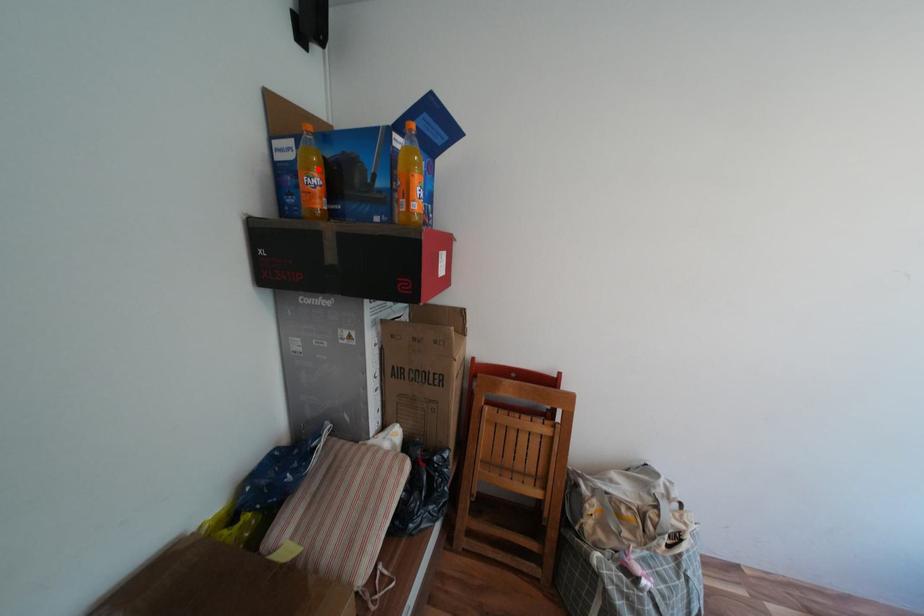
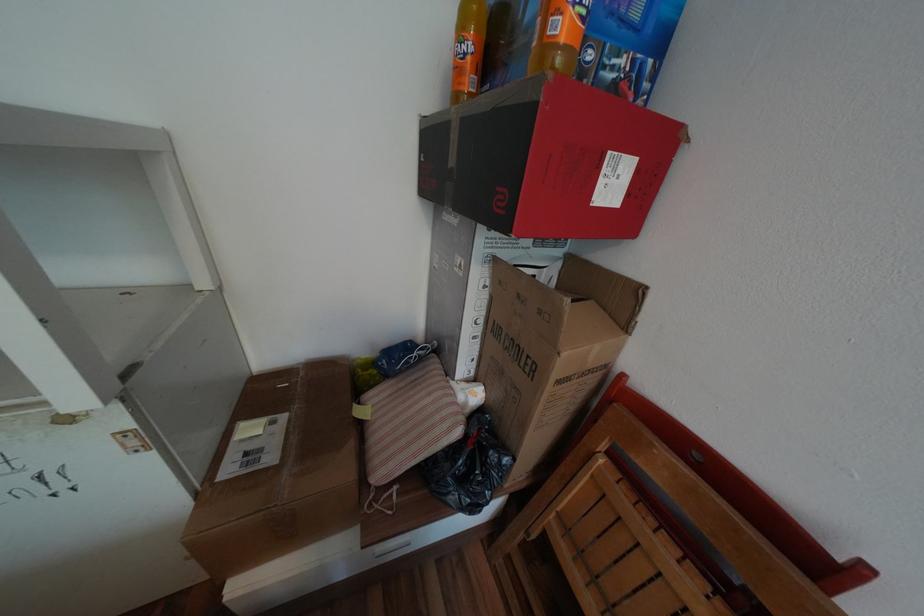
In the second image, find the point that corresponds to the highlighted location in the first image.

(472, 31)